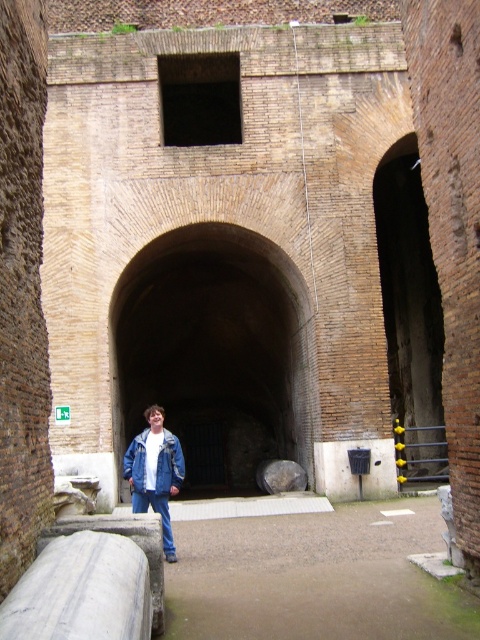
Does brick wall at right have a larger size compared to denim jacket at lower left?

Correct, brick wall at right is larger in size than denim jacket at lower left.

Who is taller, brick wall at right or denim jacket at lower left?

brick wall at right is taller.

Identify the location of brick wall at right. (410, 316).

In order to click on brick wall at right in this screenshot , I will do `click(410, 316)`.

Which is in front, point (157, 324) or point (159, 502)?

Point (159, 502) is in front.

Between point (204, 422) and point (167, 534), which one is positioned behind?

The point (204, 422) is behind.

Is point (216, 484) farther from viewer compared to point (163, 502)?

Yes, it is behind point (163, 502).

The height and width of the screenshot is (640, 480). What are the coordinates of `brick textured archway at center` in the screenshot? It's located at (214, 353).

Which is behind, point (250, 230) or point (402, 218)?

Positioned behind is point (402, 218).

Can you confirm if brick textured archway at center is shorter than brick wall at right?

Correct, brick textured archway at center is not as tall as brick wall at right.

Is point (126, 353) positioned before point (436, 388)?

No, it is behind (436, 388).

Image resolution: width=480 pixels, height=640 pixels. In order to click on brick textured archway at center in this screenshot , I will do `click(214, 353)`.